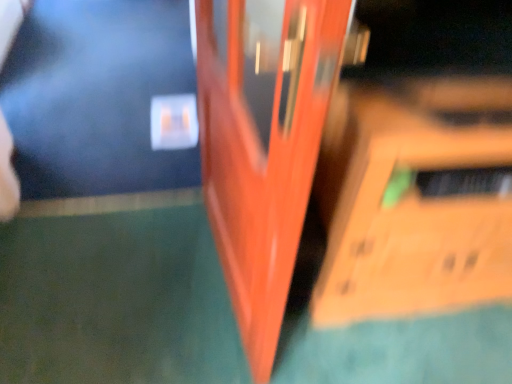
This screenshot has height=384, width=512. In order to click on orange plastic keyboard at center in this screenshot , I will do `click(414, 198)`.

Measure the distance between orange plastic keyboard at center and camera.

35.73 inches.

Describe the element at coordinates (414, 198) in the screenshot. The image size is (512, 384). I see `orange plastic keyboard at center` at that location.

You are a GUI agent. You are given a task and a screenshot of the screen. Output one action in this format:
    pyautogui.click(x=<x>, y=<y>)
    Task: Click on the orange plastic keyboard at center
    This screenshot has height=384, width=512.
    Given the screenshot: What is the action you would take?
    pyautogui.click(x=414, y=198)